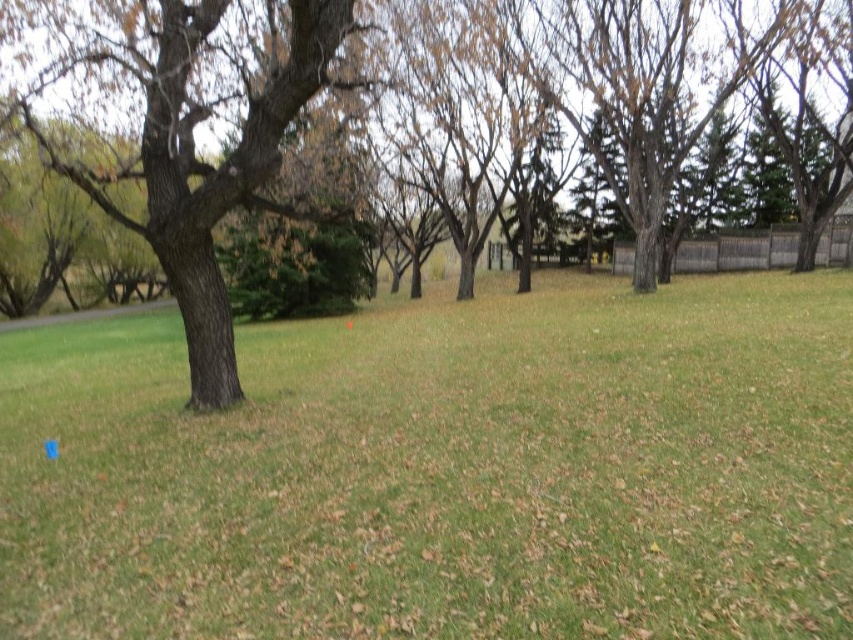
The image size is (853, 640). Identify the location of brown rough tree at left. (186, 140).

Is brown rough tree at left thinner than smooth brown tree at left?

No, brown rough tree at left is not thinner than smooth brown tree at left.

This screenshot has width=853, height=640. What do you see at coordinates (186, 140) in the screenshot?
I see `brown rough tree at left` at bounding box center [186, 140].

This screenshot has height=640, width=853. What are the coordinates of `brown rough tree at left` in the screenshot? It's located at (186, 140).